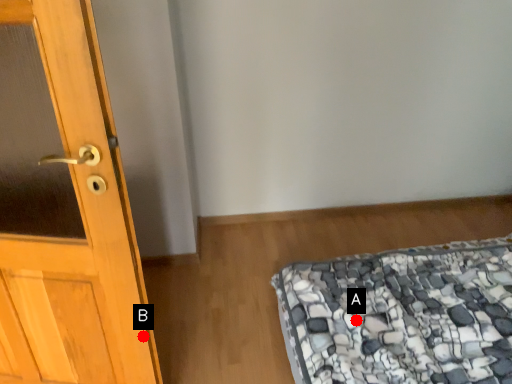
Question: Two points are circled on the image, labeled by A and B beside each circle. Which point is closer to the camera?

Choices:
 (A) A is closer
 (B) B is closer

Answer: (B)